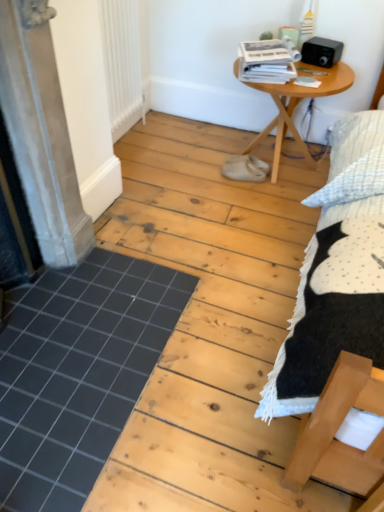
What do you see at coordinates (297, 103) in the screenshot? I see `wooden table at center` at bounding box center [297, 103].

The width and height of the screenshot is (384, 512). What do you see at coordinates (41, 132) in the screenshot?
I see `matte gray screen door at left` at bounding box center [41, 132].

At what (x,y) coordinates should I click in order to perform the action: click on black tile at lower left. Please return your answer as a coordinate pair (x, y). The image size is (384, 512). Looking at the image, I should click on (78, 372).

Where is `wooden table at center`? The height and width of the screenshot is (512, 384). wooden table at center is located at coordinates (297, 103).

From a real-world perspective, is matte gray screen door at left physically above black tile at lower left?

Yes.

Can you confirm if matte gray screen door at left is positioned to the right of black tile at lower left?

Incorrect, matte gray screen door at left is not on the right side of black tile at lower left.

Can you confirm if matte gray screen door at left is taller than black tile at lower left?

Yes, matte gray screen door at left is taller than black tile at lower left.

How far apart are white matte radiator at upper left and wooden table at center?

30.29 inches.

Based on their sizes in the image, would you say white matte radiator at upper left is bigger or smaller than wooden table at center?

Considering their sizes, white matte radiator at upper left takes up less space than wooden table at center.

Between white matte radiator at upper left and wooden table at center, which one appears on the right side from the viewer's perspective?

wooden table at center.

Considering the points (148, 79) and (291, 122), which point is behind, point (148, 79) or point (291, 122)?

The point (148, 79) is more distant.

Which is behind, point (60, 167) or point (147, 35)?

The point (147, 35) is more distant.

Considering the relative sizes of matte gray screen door at left and white matte radiator at upper left in the image provided, is matte gray screen door at left taller than white matte radiator at upper left?

Correct, matte gray screen door at left is much taller as white matte radiator at upper left.

From a real-world perspective, which object stands above the other?

matte gray screen door at left.

Which object is further away from the camera taking this photo, matte gray screen door at left or white matte radiator at upper left?

white matte radiator at upper left is further from the camera.

Are white matte radiator at upper left and black tile at lower left far apart?

Absolutely, white matte radiator at upper left is distant from black tile at lower left.

Based on the photo, from the image's perspective, is white matte radiator at upper left located above or below black tile at lower left?

From the image's perspective, white matte radiator at upper left appears above black tile at lower left.

Which is behind, white matte radiator at upper left or black tile at lower left?

white matte radiator at upper left is further from the camera.

Can you confirm if white matte radiator at upper left is wider than black tile at lower left?

No, white matte radiator at upper left is not wider than black tile at lower left.

Does point (263, 137) come in front of point (44, 390)?

No, (263, 137) is behind (44, 390).

Locate an element on the screen. This screenshot has width=384, height=512. table lying above the black tile at lower left (from the image's perspective) is located at coordinates (297, 103).

Is wooden table at center aimed at black tile at lower left?

Yes, wooden table at center is aimed at black tile at lower left.

From the image's perspective, is wooden table at center positioned above or below black tile at lower left?

Based on their image positions, wooden table at center is located above black tile at lower left.

Considering the relative positions of wooden table at center and matte gray screen door at left in the image provided, is wooden table at center to the left of matte gray screen door at left from the viewer's perspective?

Incorrect, wooden table at center is not on the left side of matte gray screen door at left.

Is wooden table at center looking in the opposite direction of matte gray screen door at left?

No, wooden table at center is not facing away from matte gray screen door at left.

Based on the photo, between wooden table at center and matte gray screen door at left, which one has less height?

wooden table at center.

From the image's perspective, is white matte radiator at upper left above matte gray screen door at left?

Correct, white matte radiator at upper left appears higher than matte gray screen door at left in the image.

Which of these two, white matte radiator at upper left or matte gray screen door at left, is thinner?

white matte radiator at upper left.

Between point (106, 17) and point (36, 223), which one is positioned behind?

Positioned behind is point (106, 17).

Is white matte radiator at upper left positioned in front of matte gray screen door at left?

No, it is not.

Where is `screen door above the black tile at lower left (from the image's perspective)`? The image size is (384, 512). screen door above the black tile at lower left (from the image's perspective) is located at coordinates (41, 132).

I want to click on radiator on the left of the wooden table at center, so click(x=125, y=62).

From the image, which object appears to be farther from white matte radiator at upper left, wooden table at center or black tile at lower left?

Based on the image, black tile at lower left appears to be further to white matte radiator at upper left.

Looking at the image, which one is located further to white matte radiator at upper left, wooden table at center or matte gray screen door at left?

matte gray screen door at left lies further to white matte radiator at upper left than the other object.

Estimate the real-world distances between objects in this image. Which object is closer to matte gray screen door at left, black tile at lower left or wooden table at center?

Based on the image, black tile at lower left appears to be nearer to matte gray screen door at left.

Estimate the real-world distances between objects in this image. Which object is closer to white matte radiator at upper left, matte gray screen door at left or wooden table at center?

The object closer to white matte radiator at upper left is wooden table at center.

Based on their spatial positions, is matte gray screen door at left or wooden table at center further from black tile at lower left?

Among the two, wooden table at center is located further to black tile at lower left.

From the image, which object appears to be farther from black tile at lower left, wooden table at center or white matte radiator at upper left?

Among the two, wooden table at center is located further to black tile at lower left.

Based on their spatial positions, is white matte radiator at upper left or wooden table at center further from matte gray screen door at left?

wooden table at center is further to matte gray screen door at left.

Based on the photo, from the image, which object appears to be farther from black tile at lower left, wooden table at center or matte gray screen door at left?

wooden table at center lies further to black tile at lower left than the other object.

Where is `table between white matte radiator at upper left and black tile at lower left from top to bottom`? This screenshot has width=384, height=512. table between white matte radiator at upper left and black tile at lower left from top to bottom is located at coordinates (297, 103).

In order to click on screen door between white matte radiator at upper left and black tile at lower left vertically in this screenshot , I will do `click(41, 132)`.

Where is `table between matte gray screen door at left and white matte radiator at upper left along the z-axis`? The image size is (384, 512). table between matte gray screen door at left and white matte radiator at upper left along the z-axis is located at coordinates (297, 103).

Where is `plank between matte gray screen door at left and wooden table at center from left to right`? plank between matte gray screen door at left and wooden table at center from left to right is located at coordinates (78, 372).